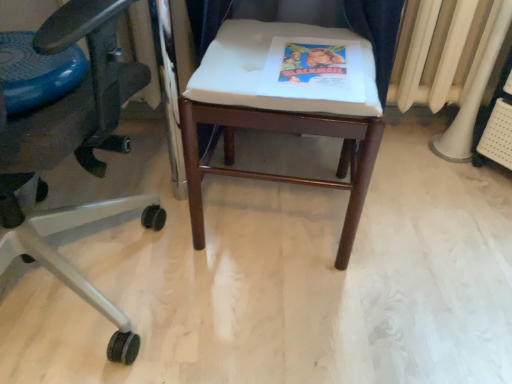
You are a GUI agent. You are given a task and a screenshot of the screen. Output one action in this format:
    pyautogui.click(x=<x>, y=<y>)
    Task: Click on the white plastic radiator at right
    The height and width of the screenshot is (384, 512).
    Given the screenshot: What is the action you would take?
    pyautogui.click(x=439, y=51)

Where is `matte black office chair at left`? matte black office chair at left is located at coordinates (74, 153).

Find the location of a particular element. The image size is (512, 384). white fabric stool at center is located at coordinates (276, 116).

This screenshot has width=512, height=384. I want to click on matte paper book at center, so click(314, 70).

From the image's perspective, relative to white fabric stool at center, is matte paper book at center above or below?

matte paper book at center is situated higher than white fabric stool at center in the image.

Which object is thinner, matte paper book at center or white fabric stool at center?

Thinner between the two is matte paper book at center.

Between matte paper book at center and white fabric stool at center, which one is positioned behind?

matte paper book at center is behind.

Considering the positions of points (58, 108) and (268, 83), is point (58, 108) closer to camera compared to point (268, 83)?

Yes, point (58, 108) is closer to viewer.

From a real-world perspective, is matte black office chair at left physically located above or below matte paper book at center?

matte black office chair at left is situated lower than matte paper book at center in the real world.

Which object is further away from the camera taking this photo, matte black office chair at left or matte paper book at center?

matte paper book at center is further away from the camera.

Does matte paper book at center contain matte black office chair at left?

No, matte black office chair at left is not inside matte paper book at center.

Between matte paper book at center and matte black office chair at left, which one has larger width?

matte black office chair at left is wider.

In terms of height, does matte paper book at center look taller or shorter compared to matte black office chair at left?

In the image, matte paper book at center appears to be shorter than matte black office chair at left.

From the image's perspective, which is above, matte paper book at center or matte black office chair at left?

matte paper book at center, from the image's perspective.

Considering the positions of objects white plastic radiator at right and white fabric stool at center in the image provided, who is more to the right, white plastic radiator at right or white fabric stool at center?

Positioned to the right is white plastic radiator at right.

From a real-world perspective, relative to white fabric stool at center, is white plastic radiator at right vertically above or below?

white plastic radiator at right is below white fabric stool at center.

Would you say white plastic radiator at right is a long distance from white fabric stool at center?

Actually, white plastic radiator at right and white fabric stool at center are a little close together.

Choose the correct answer: Is matte black office chair at left inside white plastic radiator at right or outside it?

matte black office chair at left exists outside the volume of white plastic radiator at right.

Can you confirm if matte black office chair at left is shorter than white plastic radiator at right?

In fact, matte black office chair at left may be taller than white plastic radiator at right.

How much distance is there between matte black office chair at left and white plastic radiator at right?

matte black office chair at left is 39.07 inches away from white plastic radiator at right.

Does matte black office chair at left turn towards white plastic radiator at right?

No, matte black office chair at left is not facing towards white plastic radiator at right.

Can you confirm if white fabric stool at center is thinner than white plastic radiator at right?

Incorrect, the width of white fabric stool at center is not less than that of white plastic radiator at right.

Is point (200, 99) farther from viewer compared to point (436, 17)?

No, (200, 99) is in front of (436, 17).

Does white fabric stool at center have a larger size compared to white plastic radiator at right?

Indeed, white fabric stool at center has a larger size compared to white plastic radiator at right.

In the scene shown: How distant is white fabric stool at center from white plastic radiator at right?

A distance of 53.85 centimeters exists between white fabric stool at center and white plastic radiator at right.

Which object is more forward, white plastic radiator at right or matte paper book at center?

matte paper book at center is closer to the camera.

Based on the photo, considering the positions of objects white plastic radiator at right and matte paper book at center in the image provided, who is more to the right, white plastic radiator at right or matte paper book at center?

From the viewer's perspective, white plastic radiator at right appears more on the right side.

Can you tell me how much white plastic radiator at right and matte paper book at center differ in facing direction?

The facing directions of white plastic radiator at right and matte paper book at center are 7.77 degrees apart.

From the image's perspective, is white plastic radiator at right located above or below matte paper book at center?

From the image's perspective, white plastic radiator at right appears above matte paper book at center.

Where is `stool below the matte paper book at center (from the image's perspective)`? This screenshot has height=384, width=512. stool below the matte paper book at center (from the image's perspective) is located at coordinates (276, 116).

Locate an element on the screen. The height and width of the screenshot is (384, 512). chair located underneath the matte paper book at center (from a real-world perspective) is located at coordinates (74, 153).

Looking at the image, which one is located closer to matte black office chair at left, matte paper book at center or blue rubber ball at left?

The object closer to matte black office chair at left is blue rubber ball at left.

Looking at the image, which one is located closer to matte paper book at center, white plastic radiator at right or blue rubber ball at left?

blue rubber ball at left is closer to matte paper book at center.

Estimate the real-world distances between objects in this image. Which object is closer to blue rubber ball at left, matte black office chair at left or white plastic radiator at right?

Based on the image, matte black office chair at left appears to be nearer to blue rubber ball at left.

Which object lies nearer to the anchor point white plastic radiator at right, white fabric stool at center or matte black office chair at left?

Among the two, white fabric stool at center is located nearer to white plastic radiator at right.

Estimate the real-world distances between objects in this image. Which object is further from blue rubber ball at left, matte paper book at center or white fabric stool at center?

Among the two, matte paper book at center is located further to blue rubber ball at left.

Looking at the image, which one is located further to matte paper book at center, matte black office chair at left or white fabric stool at center?

matte black office chair at left.

Estimate the real-world distances between objects in this image. Which object is further from matte black office chair at left, white plastic radiator at right or blue rubber ball at left?

Based on the image, white plastic radiator at right appears to be further to matte black office chair at left.

Consider the image. When comparing their distances from white fabric stool at center, does blue rubber ball at left or matte paper book at center seem closer?

matte paper book at center is closer to white fabric stool at center.

The width and height of the screenshot is (512, 384). I want to click on stool between blue rubber ball at left and matte paper book at center from left to right, so click(x=276, y=116).

Identify the location of round table situated between matte black office chair at left and matte paper book at center from left to right. The image size is (512, 384). (36, 73).

At what (x,y) coordinates should I click in order to perform the action: click on round table between matte black office chair at left and white plastic radiator at right in the horizontal direction. Please return your answer as a coordinate pair (x, y). This screenshot has height=384, width=512. Looking at the image, I should click on click(36, 73).

At what (x,y) coordinates should I click in order to perform the action: click on paperback book between matte black office chair at left and white plastic radiator at right from left to right. Please return your answer as a coordinate pair (x, y). The height and width of the screenshot is (384, 512). Looking at the image, I should click on (314, 70).